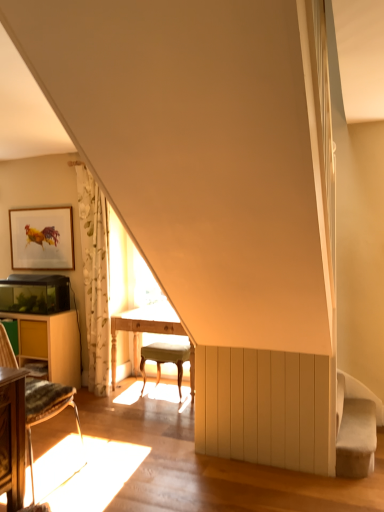
You are a GUI agent. You are given a task and a screenshot of the screen. Output one action in this format:
    pyautogui.click(x=<x>, y=<y>)
    Task: Click on the light beige fabric stool at center
    The image size is (384, 512).
    Given the screenshot: What is the action you would take?
    pyautogui.click(x=168, y=361)

In order to click on light wood table at center, which is counted as the first table, starting from the right in this screenshot , I will do `click(143, 329)`.

At what (x,y) coordinates should I click in order to perform the action: click on wooden table at left, the 1th table when ordered from left to right. Please return your answer as a coordinate pair (x, y). The width and height of the screenshot is (384, 512). Looking at the image, I should click on (50, 345).

The image size is (384, 512). What are the coordinates of `gold-framed artwork at upper left` in the screenshot? It's located at (42, 238).

I want to click on wooden chair at lower left, so [46, 410].

This screenshot has width=384, height=512. Identify the location of light beige fabric stool at center. (168, 361).

How much distance is there between wooden chair at lower left and gold-framed artwork at upper left?

The distance of wooden chair at lower left from gold-framed artwork at upper left is 5.02 feet.

Is wooden chair at lower left looking in the opposite direction of gold-framed artwork at upper left?

wooden chair at lower left does not have its back to gold-framed artwork at upper left.

Is wooden chair at lower left outside of gold-framed artwork at upper left?

Yes.

Does wooden chair at lower left appear on the left side of gold-framed artwork at upper left?

Incorrect, wooden chair at lower left is not on the left side of gold-framed artwork at upper left.

Consider the image. Is gold-framed artwork at upper left completely or partially outside of wooden chair at lower left?

Yes, gold-framed artwork at upper left is located beyond the bounds of wooden chair at lower left.

From a real-world perspective, which is physically below, gold-framed artwork at upper left or wooden chair at lower left?

wooden chair at lower left is physically lower.

Between point (42, 236) and point (28, 426), which one is positioned behind?

The point (42, 236) is more distant.

From the picture: Can you tell me how much gold-framed artwork at upper left and wooden chair at lower left differ in facing direction?

The angular difference between gold-framed artwork at upper left and wooden chair at lower left is 85.4 degrees.

From the image's perspective, relative to light beige fabric stool at center, is wooden table at left, the 1th table when ordered from left to right, above or below?

From the image's perspective, wooden table at left, the 1th table when ordered from left to right, appears above light beige fabric stool at center.

From the picture: Which object is more forward, wooden table at left, the 1th table when ordered from left to right, or light beige fabric stool at center?

light beige fabric stool at center is in front.

Does wooden table at left, marked as the 2th table in a right-to-left arrangement, contain light beige fabric stool at center?

No, light beige fabric stool at center is not inside wooden table at left, marked as the 2th table in a right-to-left arrangement.

From the picture: Which is more to the right, wooden table at left, marked as the 2th table in a right-to-left arrangement, or light beige fabric stool at center?

From the viewer's perspective, light beige fabric stool at center appears more on the right side.

Consider the image. Is light beige fabric stool at center surrounding wooden table at left, marked as the 2th table in a right-to-left arrangement?

No, wooden table at left, marked as the 2th table in a right-to-left arrangement, is not a part of light beige fabric stool at center.

Is light beige fabric stool at center aimed at wooden table at left, the 1th table when ordered from left to right?

No, light beige fabric stool at center is not turned towards wooden table at left, the 1th table when ordered from left to right.

At what (x,y) coordinates should I click in order to perform the action: click on table that is the 2nd one when counting upward from the light beige fabric stool at center (from the image's perspective). Please return your answer as a coordinate pair (x, y). Looking at the image, I should click on (50, 345).

Is light beige fabric stool at center shorter than wooden table at left, marked as the 2th table in a right-to-left arrangement?

Correct, light beige fabric stool at center is not as tall as wooden table at left, marked as the 2th table in a right-to-left arrangement.

Does wooden table at left, the 1th table when ordered from left to right, turn towards gold-framed artwork at upper left?

No, wooden table at left, the 1th table when ordered from left to right, is not facing towards gold-framed artwork at upper left.

Is wooden table at left, the 1th table when ordered from left to right, shorter than gold-framed artwork at upper left?

In fact, wooden table at left, the 1th table when ordered from left to right, may be taller than gold-framed artwork at upper left.

Is point (355, 443) in front of point (28, 398)?

No, it is not.

From a real-world perspective, is velvet beige swivel chair at lower right positioned above or below wooden chair at lower left?

velvet beige swivel chair at lower right is situated lower than wooden chair at lower left in the real world.

Between velvet beige swivel chair at lower right and wooden chair at lower left, which one has smaller size?

With smaller size is velvet beige swivel chair at lower right.

Considering the sizes of velvet beige swivel chair at lower right and wooden chair at lower left in the image, is velvet beige swivel chair at lower right wider or thinner than wooden chair at lower left?

Considering their sizes, velvet beige swivel chair at lower right looks slimmer than wooden chair at lower left.

Is point (60, 215) closer to viewer compared to point (359, 402)?

No, it is not.

You are a GUI agent. You are given a task and a screenshot of the screen. Output one action in this format:
    pyautogui.click(x=<x>, y=<y>)
    Task: Click on the swivel chair that is in front of the gold-framed artwork at upper left
    Image resolution: width=384 pixels, height=512 pixels.
    Given the screenshot: What is the action you would take?
    pyautogui.click(x=354, y=432)

Is gold-framed artwork at upper left bigger than velvet beige swivel chair at lower right?

Incorrect, gold-framed artwork at upper left is not larger than velvet beige swivel chair at lower right.

The width and height of the screenshot is (384, 512). Find the location of `chair beneath the gold-framed artwork at upper left (from a real-world perspective)`. chair beneath the gold-framed artwork at upper left (from a real-world perspective) is located at coordinates (46, 410).

Locate an element on the screen. picture frame on the left of wooden chair at lower left is located at coordinates (42, 238).

Considering their positions, is wooden chair at lower left positioned further to light beige fabric stool at center than gold-framed artwork at upper left?

Among the two, gold-framed artwork at upper left is located further to light beige fabric stool at center.

Estimate the real-world distances between objects in this image. Which object is closer to light wood table at center, which appears as the 2th table when viewed from the left, light beige fabric stool at center or velvet beige swivel chair at lower right?

light beige fabric stool at center is closer to light wood table at center, which appears as the 2th table when viewed from the left.

Looking at the image, which one is located closer to white floral fabric curtain at left, velvet beige swivel chair at lower right or light wood table at center, which appears as the 2th table when viewed from the left?

Based on the image, light wood table at center, which appears as the 2th table when viewed from the left, appears to be nearer to white floral fabric curtain at left.

Considering their positions, is white floral fabric curtain at left positioned further to light beige fabric stool at center than gold-framed artwork at upper left?

The object further to light beige fabric stool at center is gold-framed artwork at upper left.

Estimate the real-world distances between objects in this image. Which object is closer to velvet beige swivel chair at lower right, wooden chair at lower left or gold-framed artwork at upper left?

wooden chair at lower left lies closer to velvet beige swivel chair at lower right than the other object.

Based on their spatial positions, is wooden table at left, marked as the 2th table in a right-to-left arrangement, or light beige fabric stool at center further from velvet beige swivel chair at lower right?

wooden table at left, marked as the 2th table in a right-to-left arrangement, lies further to velvet beige swivel chair at lower right than the other object.

In the scene shown: Based on their spatial positions, is wooden table at left, the 1th table when ordered from left to right, or gold-framed artwork at upper left closer to wooden chair at lower left?

The object closer to wooden chair at lower left is wooden table at left, the 1th table when ordered from left to right.

Estimate the real-world distances between objects in this image. Which object is closer to white floral fabric curtain at left, wooden chair at lower left or velvet beige swivel chair at lower right?

wooden chair at lower left lies closer to white floral fabric curtain at left than the other object.

The width and height of the screenshot is (384, 512). In order to click on stool between wooden chair at lower left and white floral fabric curtain at left in the front-back direction in this screenshot , I will do `click(168, 361)`.

At what (x,y) coordinates should I click in order to perform the action: click on table between white floral fabric curtain at left and velvet beige swivel chair at lower right from left to right. Please return your answer as a coordinate pair (x, y). Looking at the image, I should click on (143, 329).

Find the location of a particular element. This screenshot has height=512, width=384. curtain positioned between wooden chair at lower left and gold-framed artwork at upper left from near to far is located at coordinates click(x=95, y=277).

This screenshot has width=384, height=512. Find the location of `stool between white floral fabric curtain at left and velvet beige swivel chair at lower right in the horizontal direction`. stool between white floral fabric curtain at left and velvet beige swivel chair at lower right in the horizontal direction is located at coordinates (168, 361).